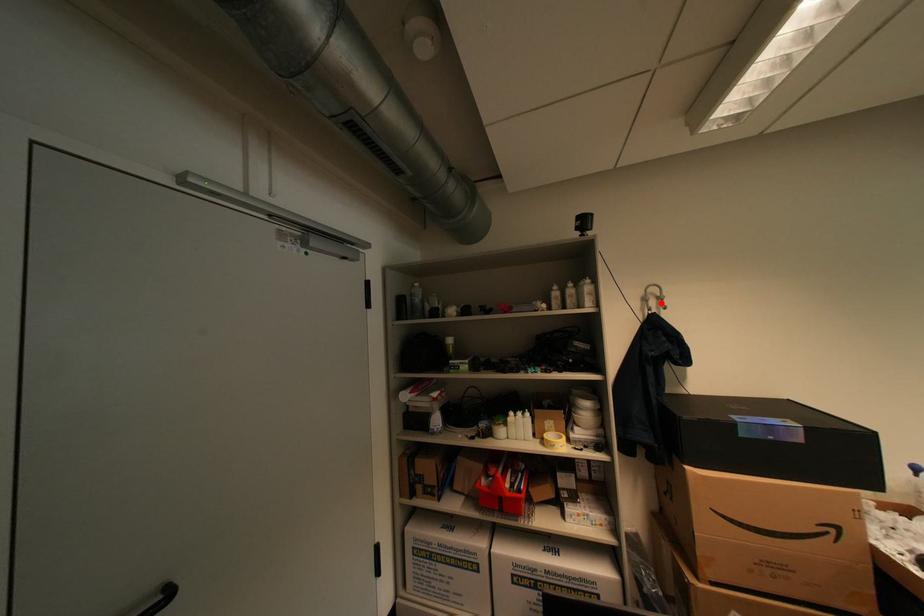
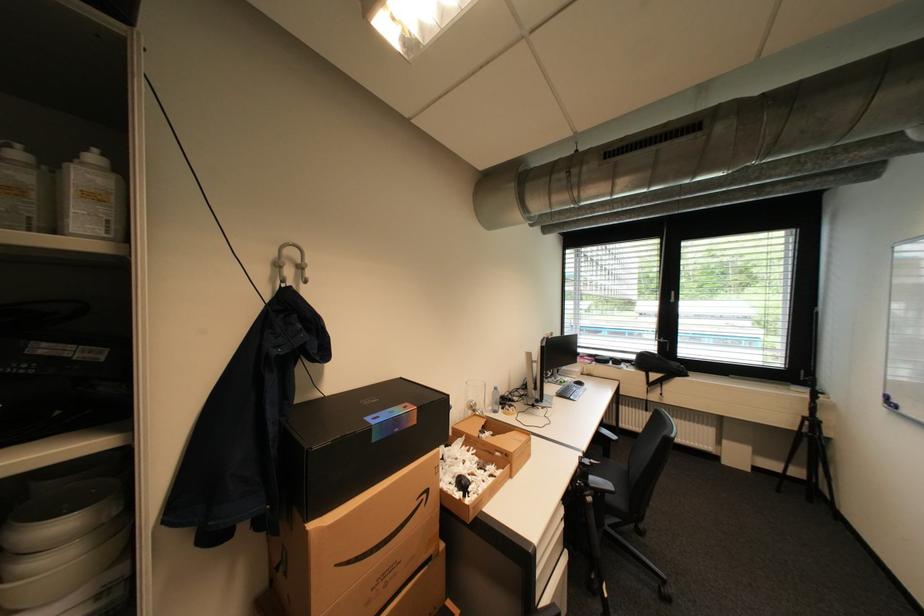
Locate, in the second image, the point that corresponds to the highlighted location in the first image.

(297, 272)